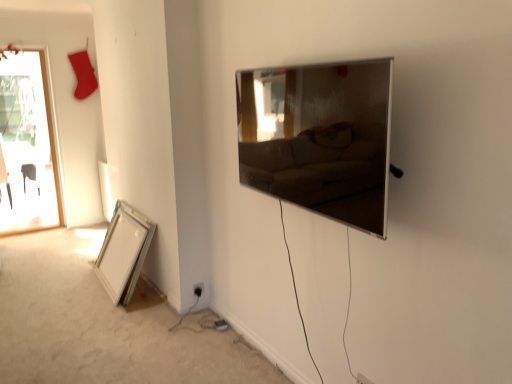
Locate an element on the screen. The width and height of the screenshot is (512, 384). satin silver tv at upper right, which is counted as the 1th picture frame, starting from the right is located at coordinates (319, 138).

In order to click on white plastic electric outlet at lower center, the first electric outlet when ordered from front to back in this screenshot , I will do `click(362, 379)`.

At what (x,y) coordinates should I click in order to perform the action: click on satin silver tv at upper right, arranged as the second picture frame when ordered from the bottom. Please return your answer as a coordinate pair (x, y). Looking at the image, I should click on (319, 138).

Is white plastic electric outlet at lower center, the first electric outlet when ordered from front to back, at the right side of satin silver tv at upper right, which is the 2th picture frame from left to right?

Indeed, white plastic electric outlet at lower center, the first electric outlet when ordered from front to back, is positioned on the right side of satin silver tv at upper right, which is the 2th picture frame from left to right.

The height and width of the screenshot is (384, 512). Identify the location of electric outlet that is the 1st object located behind the satin silver tv at upper right, which is the 2th picture frame from left to right. (362, 379).

Is white plastic electric outlet at lower center, positioned as the 1th electric outlet in bottom-to-top order, in contact with satin silver tv at upper right, which is counted as the 1th picture frame, starting from the right?

No, white plastic electric outlet at lower center, positioned as the 1th electric outlet in bottom-to-top order, is not in contact with satin silver tv at upper right, which is counted as the 1th picture frame, starting from the right.

In the scene shown: In terms of size, does white plastic electric outlet at lower center, marked as the 2th electric outlet in a left-to-right arrangement, appear bigger or smaller than satin silver tv at upper right, which is the 2th picture frame from left to right?

white plastic electric outlet at lower center, marked as the 2th electric outlet in a left-to-right arrangement, is smaller than satin silver tv at upper right, which is the 2th picture frame from left to right.

Can you tell me how much silver metallic picture frame at lower left, positioned as the second picture frame in front-to-back order, and black plastic electric outlet at lower center, arranged as the 1th electric outlet when viewed from the back, differ in facing direction?

There is a 92.6-degree angle between the facing directions of silver metallic picture frame at lower left, positioned as the second picture frame in front-to-back order, and black plastic electric outlet at lower center, arranged as the 1th electric outlet when viewed from the back.

Can you confirm if silver metallic picture frame at lower left, the 1th picture frame from the back, is positioned to the left of black plastic electric outlet at lower center, which ranks as the second electric outlet in bottom-to-top order?

Yes.

Considering their positions, is silver metallic picture frame at lower left, positioned as the second picture frame in front-to-back order, located in front of or behind black plastic electric outlet at lower center, which ranks as the second electric outlet in bottom-to-top order?

Visually, silver metallic picture frame at lower left, positioned as the second picture frame in front-to-back order, is located in front of black plastic electric outlet at lower center, which ranks as the second electric outlet in bottom-to-top order.

From a real-world perspective, between silver metallic picture frame at lower left, the 1th picture frame positioned from the left, and black plastic electric outlet at lower center, the first electric outlet positioned from the top, who is vertically lower?

black plastic electric outlet at lower center, the first electric outlet positioned from the top, from a real-world perspective.

Is the depth of satin silver tv at upper right, arranged as the second picture frame when ordered from the bottom, greater than that of black plastic electric outlet at lower center, arranged as the 1th electric outlet when viewed from the back?

No, satin silver tv at upper right, arranged as the second picture frame when ordered from the bottom, is closer to the camera.

Is satin silver tv at upper right, arranged as the second picture frame when ordered from the bottom, turned away from black plastic electric outlet at lower center, marked as the 2th electric outlet in a front-to-back arrangement?

No, satin silver tv at upper right, arranged as the second picture frame when ordered from the bottom, is not facing away from black plastic electric outlet at lower center, marked as the 2th electric outlet in a front-to-back arrangement.

Is satin silver tv at upper right, arranged as the 1th picture frame when viewed from the front, placed right next to black plastic electric outlet at lower center, the first electric outlet positioned from the top?

No, satin silver tv at upper right, arranged as the 1th picture frame when viewed from the front, is not making contact with black plastic electric outlet at lower center, the first electric outlet positioned from the top.

Considering the points (339, 212) and (198, 288), which point is in front, point (339, 212) or point (198, 288)?

The point (339, 212) is in front.

Considering the relative positions of satin silver tv at upper right, which is counted as the 2th picture frame, starting from the back, and white plastic electric outlet at lower center, which is the 1th electric outlet from right to left, in the image provided, is satin silver tv at upper right, which is counted as the 2th picture frame, starting from the back, to the right of white plastic electric outlet at lower center, which is the 1th electric outlet from right to left, from the viewer's perspective?

No, satin silver tv at upper right, which is counted as the 2th picture frame, starting from the back, is not to the right of white plastic electric outlet at lower center, which is the 1th electric outlet from right to left.

Does satin silver tv at upper right, arranged as the 1th picture frame when viewed from the front, come in front of white plastic electric outlet at lower center, marked as the 2th electric outlet in a left-to-right arrangement?

Yes.

Which is in front, point (285, 152) or point (362, 382)?

Positioned in front is point (362, 382).

From a real-world perspective, is satin silver tv at upper right, which is counted as the 2th picture frame, starting from the back, positioned over white plastic electric outlet at lower center, the second electric outlet viewed from the back, based on gravity?

Yes, from a real-world perspective, satin silver tv at upper right, which is counted as the 2th picture frame, starting from the back, is over white plastic electric outlet at lower center, the second electric outlet viewed from the back

Is point (201, 292) closer to camera compared to point (102, 251)?

Yes, it is in front of point (102, 251).

Could you tell me if black plastic electric outlet at lower center, the first electric outlet positioned from the top, is turned towards silver metallic picture frame at lower left, the 1th picture frame when ordered from bottom to top?

No, black plastic electric outlet at lower center, the first electric outlet positioned from the top, is not aimed at silver metallic picture frame at lower left, the 1th picture frame when ordered from bottom to top.

How different are the orientations of black plastic electric outlet at lower center, which is the 2th electric outlet in right-to-left order, and silver metallic picture frame at lower left, the 1th picture frame when ordered from bottom to top, in degrees?

92.6 degrees.

From a real-world perspective, is black plastic electric outlet at lower center, marked as the 2th electric outlet in a front-to-back arrangement, above or below silver metallic picture frame at lower left, which is counted as the second picture frame, starting from the right?

In terms of real-world spatial position, black plastic electric outlet at lower center, marked as the 2th electric outlet in a front-to-back arrangement, is below silver metallic picture frame at lower left, which is counted as the second picture frame, starting from the right.

Is black plastic electric outlet at lower center, arranged as the 1th electric outlet when viewed from the back, to the right of white plastic electric outlet at lower center, the first electric outlet when ordered from front to back, from the viewer's perspective?

No.

Between black plastic electric outlet at lower center, arranged as the 1th electric outlet when viewed from the back, and white plastic electric outlet at lower center, marked as the 2th electric outlet in a left-to-right arrangement, which one is positioned in front?

white plastic electric outlet at lower center, marked as the 2th electric outlet in a left-to-right arrangement, is more forward.

Is black plastic electric outlet at lower center, the 1th electric outlet when ordered from left to right, facing towards white plastic electric outlet at lower center, marked as the 2th electric outlet in a left-to-right arrangement?

Yes, black plastic electric outlet at lower center, the 1th electric outlet when ordered from left to right, faces towards white plastic electric outlet at lower center, marked as the 2th electric outlet in a left-to-right arrangement.

How many degrees apart are the facing directions of black plastic electric outlet at lower center, which is the 2th electric outlet in right-to-left order, and white plastic electric outlet at lower center, which is the 1th electric outlet from right to left?

There is a 90-degree angle between the facing directions of black plastic electric outlet at lower center, which is the 2th electric outlet in right-to-left order, and white plastic electric outlet at lower center, which is the 1th electric outlet from right to left.

From a real-world perspective, which is physically below, satin silver tv at upper right, arranged as the second picture frame when ordered from the bottom, or silver metallic picture frame at lower left, positioned as the second picture frame in front-to-back order?

silver metallic picture frame at lower left, positioned as the second picture frame in front-to-back order.

Between satin silver tv at upper right, arranged as the second picture frame when ordered from the bottom, and silver metallic picture frame at lower left, which ranks as the 2th picture frame in top-to-bottom order, which one appears on the right side from the viewer's perspective?

From the viewer's perspective, satin silver tv at upper right, arranged as the second picture frame when ordered from the bottom, appears more on the right side.

Is satin silver tv at upper right, which is counted as the 1th picture frame, starting from the right, situated inside silver metallic picture frame at lower left, the 1th picture frame when ordered from bottom to top, or outside?

satin silver tv at upper right, which is counted as the 1th picture frame, starting from the right, is not enclosed by silver metallic picture frame at lower left, the 1th picture frame when ordered from bottom to top.

Considering the sizes of objects satin silver tv at upper right, which is counted as the 2th picture frame, starting from the back, and silver metallic picture frame at lower left, positioned as the second picture frame in front-to-back order, in the image provided, who is bigger, satin silver tv at upper right, which is counted as the 2th picture frame, starting from the back, or silver metallic picture frame at lower left, positioned as the second picture frame in front-to-back order,?

silver metallic picture frame at lower left, positioned as the second picture frame in front-to-back order, is bigger.

I want to click on electric outlet that appears on the right of satin silver tv at upper right, which is counted as the 1th picture frame, starting from the right, so click(x=362, y=379).

This screenshot has width=512, height=384. I want to click on the 1st picture frame above the black plastic electric outlet at lower center, marked as the 2th electric outlet in a front-to-back arrangement (from the image's perspective), so click(x=124, y=252).

Estimate the real-world distances between objects in this image. Which object is closer to black plastic electric outlet at lower center, which is the 2th electric outlet in right-to-left order, satin silver tv at upper right, which is the 2th picture frame from left to right, or silver metallic picture frame at lower left, the 1th picture frame when ordered from bottom to top?

silver metallic picture frame at lower left, the 1th picture frame when ordered from bottom to top, is closer to black plastic electric outlet at lower center, which is the 2th electric outlet in right-to-left order.

Looking at the image, which one is located further to silver metallic picture frame at lower left, the 1th picture frame when ordered from bottom to top, white plastic electric outlet at lower center, which is counted as the 2th electric outlet, starting from the top, or black plastic electric outlet at lower center, the first electric outlet positioned from the top?

The object further to silver metallic picture frame at lower left, the 1th picture frame when ordered from bottom to top, is white plastic electric outlet at lower center, which is counted as the 2th electric outlet, starting from the top.

When comparing their distances from black plastic electric outlet at lower center, which ranks as the second electric outlet in bottom-to-top order, does white plastic electric outlet at lower center, the first electric outlet when ordered from front to back, or satin silver tv at upper right, arranged as the second picture frame when ordered from the bottom, seem closer?

Based on the image, white plastic electric outlet at lower center, the first electric outlet when ordered from front to back, appears to be nearer to black plastic electric outlet at lower center, which ranks as the second electric outlet in bottom-to-top order.

From the image, which object appears to be nearer to white plastic electric outlet at lower center, positioned as the 1th electric outlet in bottom-to-top order, silver metallic picture frame at lower left, which ranks as the 2th picture frame in top-to-bottom order, or black plastic electric outlet at lower center, the 1th electric outlet when ordered from left to right?

black plastic electric outlet at lower center, the 1th electric outlet when ordered from left to right, lies closer to white plastic electric outlet at lower center, positioned as the 1th electric outlet in bottom-to-top order, than the other object.

Estimate the real-world distances between objects in this image. Which object is closer to silver metallic picture frame at lower left, the 1th picture frame from the back, white plastic electric outlet at lower center, which is the 1th electric outlet from right to left, or satin silver tv at upper right, arranged as the second picture frame when ordered from the bottom?

The object closer to silver metallic picture frame at lower left, the 1th picture frame from the back, is satin silver tv at upper right, arranged as the second picture frame when ordered from the bottom.

Based on the photo, which object lies further to the anchor point satin silver tv at upper right, arranged as the first picture frame when viewed from the top, white plastic electric outlet at lower center, which is the 1th electric outlet from right to left, or black plastic electric outlet at lower center, the first electric outlet positioned from the top?

The object further to satin silver tv at upper right, arranged as the first picture frame when viewed from the top, is black plastic electric outlet at lower center, the first electric outlet positioned from the top.

Estimate the real-world distances between objects in this image. Which object is further from black plastic electric outlet at lower center, marked as the 2th electric outlet in a front-to-back arrangement, satin silver tv at upper right, which is counted as the 1th picture frame, starting from the right, or white plastic electric outlet at lower center, positioned as the 1th electric outlet in bottom-to-top order?

satin silver tv at upper right, which is counted as the 1th picture frame, starting from the right, is further to black plastic electric outlet at lower center, marked as the 2th electric outlet in a front-to-back arrangement.

Which object lies nearer to the anchor point satin silver tv at upper right, arranged as the first picture frame when viewed from the top, black plastic electric outlet at lower center, arranged as the 1th electric outlet when viewed from the back, or silver metallic picture frame at lower left, the 1th picture frame when ordered from bottom to top?

black plastic electric outlet at lower center, arranged as the 1th electric outlet when viewed from the back.

Image resolution: width=512 pixels, height=384 pixels. Identify the location of electric outlet situated between silver metallic picture frame at lower left, the 1th picture frame from the back, and white plastic electric outlet at lower center, which is counted as the 2th electric outlet, starting from the top, from left to right. (198, 289).

This screenshot has width=512, height=384. Identify the location of electric outlet between satin silver tv at upper right, which is counted as the 2th picture frame, starting from the back, and black plastic electric outlet at lower center, the 1th electric outlet when ordered from left to right, along the z-axis. (362, 379).

Identify the location of picture frame located between satin silver tv at upper right, which is counted as the 1th picture frame, starting from the right, and black plastic electric outlet at lower center, the 1th electric outlet when ordered from left to right, in the depth direction. (124, 252).

Where is `electric outlet between satin silver tv at upper right, arranged as the first picture frame when viewed from the top, and silver metallic picture frame at lower left, the 1th picture frame positioned from the left, from front to back`? The image size is (512, 384). electric outlet between satin silver tv at upper right, arranged as the first picture frame when viewed from the top, and silver metallic picture frame at lower left, the 1th picture frame positioned from the left, from front to back is located at coordinates (362, 379).